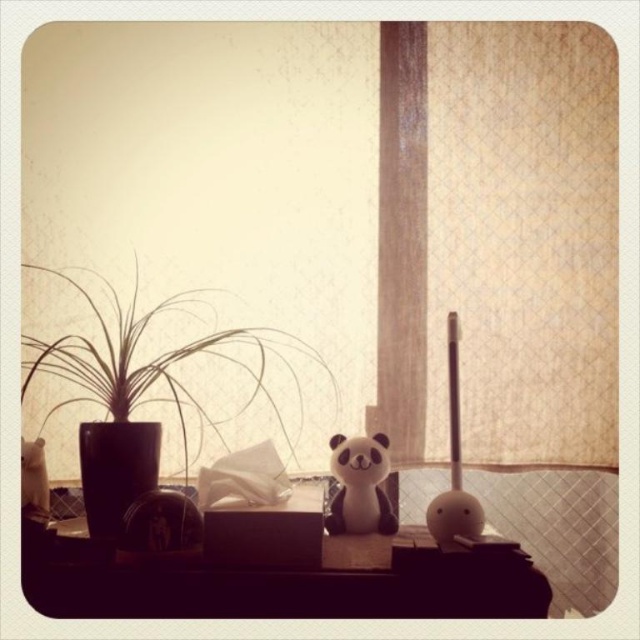
Is white textured curtain at center further to the viewer compared to green matte plant at left?

Yes, white textured curtain at center is behind green matte plant at left.

Does white textured curtain at center appear on the right side of green matte plant at left?

Yes, white textured curtain at center is to the right of green matte plant at left.

Which is in front, point (384, 259) or point (51, 268)?

Positioned in front is point (384, 259).

Find the location of `white textured curtain at center`. white textured curtain at center is located at coordinates (499, 237).

Does white textured curtain at center have a lesser height compared to white plush bear at center?

In fact, white textured curtain at center may be taller than white plush bear at center.

Is point (592, 216) farther from viewer compared to point (339, 477)?

Yes, it is.

Based on the photo, measure the distance between point (513, 54) and camera.

They are 1.53 meters apart.

Locate an element on the screen. The width and height of the screenshot is (640, 640). white textured curtain at center is located at coordinates (499, 237).

Does black wood table at center appear under green matte plant at left?

Correct, black wood table at center is located below green matte plant at left.

Does black wood table at center appear on the right side of green matte plant at left?

Yes, black wood table at center is to the right of green matte plant at left.

Does point (371, 579) come in front of point (113, 360)?

That is True.

Find the location of a particular element. black wood table at center is located at coordinates (282, 582).